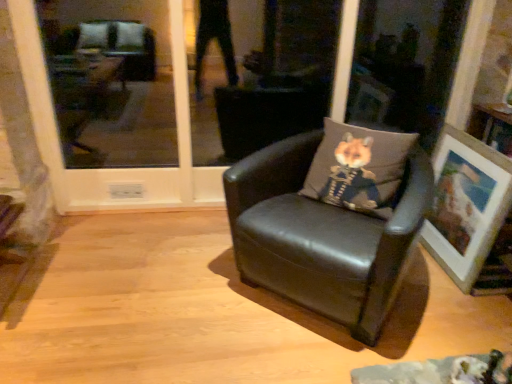
Locate an element on the screen. The height and width of the screenshot is (384, 512). free region on the left part of black leather chair at center is located at coordinates (173, 285).